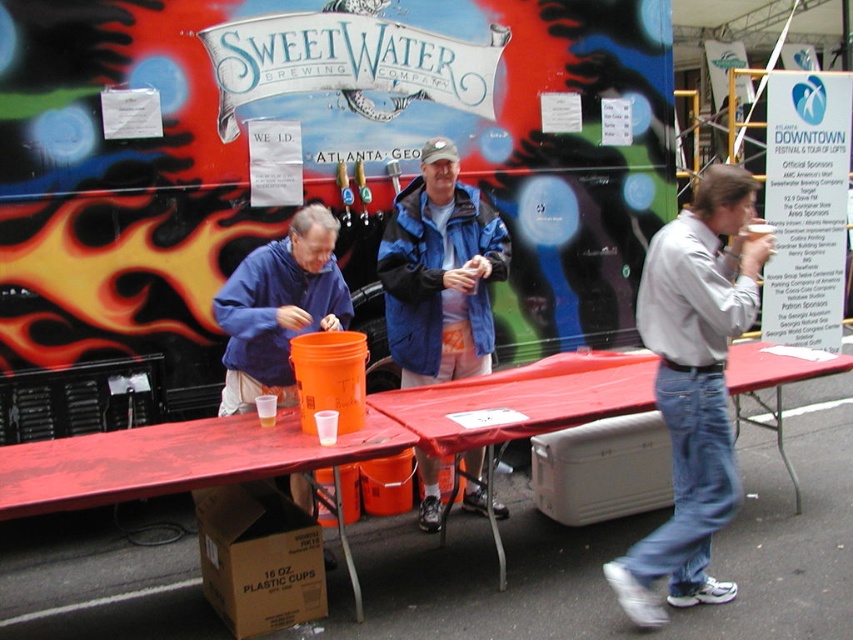
Is point (192, 461) more distant than point (772, 380)?

No, (192, 461) is in front of (772, 380).

Where is `orange plastic bucket at lower left`? Image resolution: width=853 pixels, height=640 pixels. orange plastic bucket at lower left is located at coordinates (175, 460).

Which of these two, blue fleece jacket at center or red plastic table at center, stands shorter?

Standing shorter between the two is red plastic table at center.

Measure the distance between blue fleece jacket at center and red plastic table at center.

They are 22.89 inches apart.

Who is more distant from viewer, (492, 348) or (640, 404)?

The point (492, 348) is more distant.

Locate an element on the screen. This screenshot has height=640, width=853. blue fleece jacket at center is located at coordinates (440, 273).

This screenshot has height=640, width=853. What do you see at coordinates (440, 273) in the screenshot? I see `blue fleece jacket at center` at bounding box center [440, 273].

Is blue fleece jacket at center in front of orange plastic bucket at lower left?

No, blue fleece jacket at center is behind orange plastic bucket at lower left.

Describe the element at coordinates (440, 273) in the screenshot. This screenshot has height=640, width=853. I see `blue fleece jacket at center` at that location.

In order to click on blue fleece jacket at center in this screenshot , I will do `click(440, 273)`.